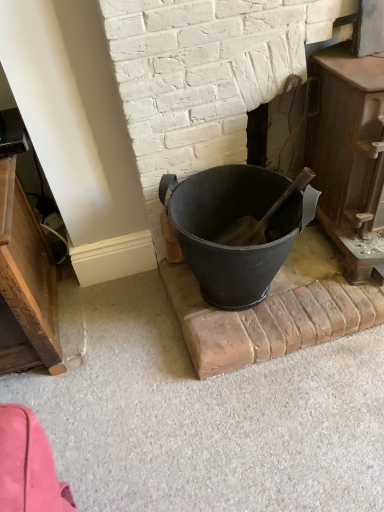
Question: From the image's perspective, relative to rustic wood stove at right, is matte black bucket at center above or below?

Choices:
 (A) above
 (B) below

Answer: (B)

Question: Considering their positions, is matte black bucket at center located in front of or behind rustic wood stove at right?

Choices:
 (A) behind
 (B) front

Answer: (A)

Question: Looking at their shapes, would you say matte black bucket at center is wider or thinner than rustic wood stove at right?

Choices:
 (A) thin
 (B) wide

Answer: (A)

Question: Is rustic wood stove at right taller or shorter than matte black bucket at center?

Choices:
 (A) short
 (B) tall

Answer: (B)

Question: In the image, is rustic wood stove at right positioned in front of or behind matte black bucket at center?

Choices:
 (A) behind
 (B) front

Answer: (B)

Question: Is rustic wood stove at right bigger or smaller than matte black bucket at center?

Choices:
 (A) small
 (B) big

Answer: (B)

Question: Considering the positions of rustic wood stove at right and matte black bucket at center in the image, is rustic wood stove at right wider or thinner than matte black bucket at center?

Choices:
 (A) wide
 (B) thin

Answer: (A)